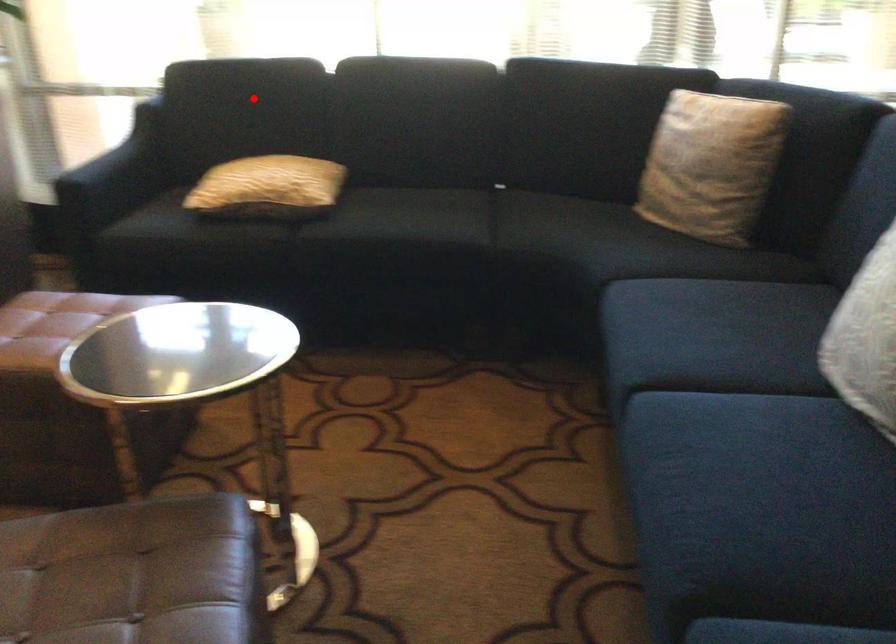
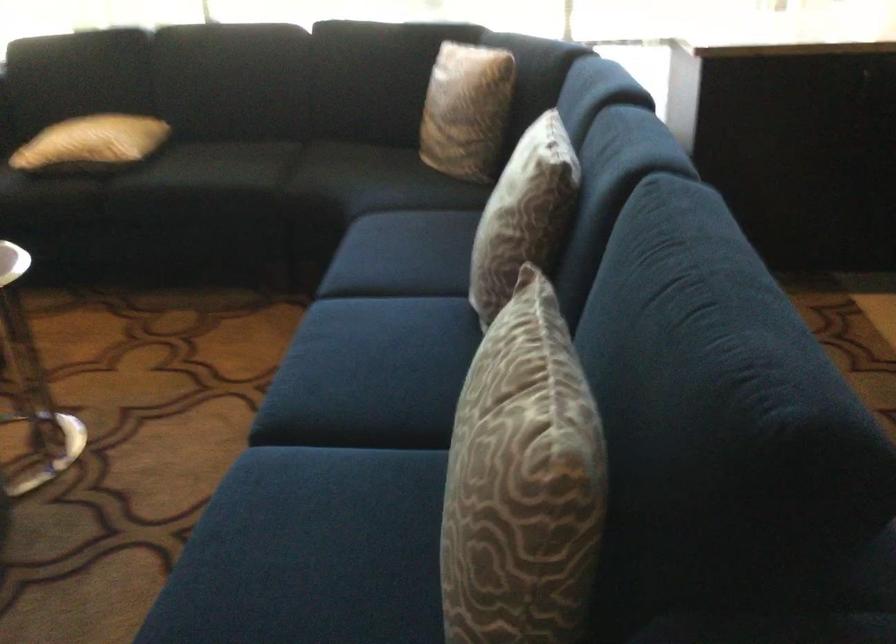
Find the pixel in the second image that matches the highlighted location in the first image.

(82, 64)